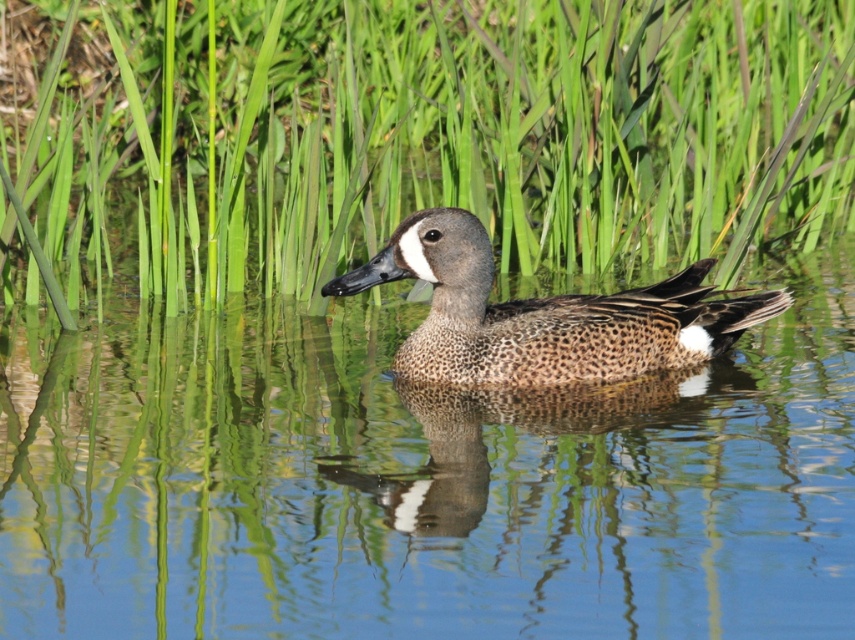
Question: Can you confirm if green grass at center is wider than speckled feathered duck at center?

Choices:
 (A) no
 (B) yes

Answer: (B)

Question: Which object appears farthest from the camera in this image?

Choices:
 (A) speckled feathered duck at center
 (B) green grass at center

Answer: (B)

Question: Which object appears farthest from the camera in this image?

Choices:
 (A) speckled feathered duck at center
 (B) green grass at center

Answer: (B)

Question: Which of the following is the farthest from the observer?

Choices:
 (A) speckled feathered duck at center
 (B) green grass at center

Answer: (B)

Question: Where is green grass at center located in relation to speckled feathered duck at center in the image?

Choices:
 (A) right
 (B) left

Answer: (B)

Question: Does green grass at center have a lesser width compared to speckled feathered duck at center?

Choices:
 (A) no
 (B) yes

Answer: (A)